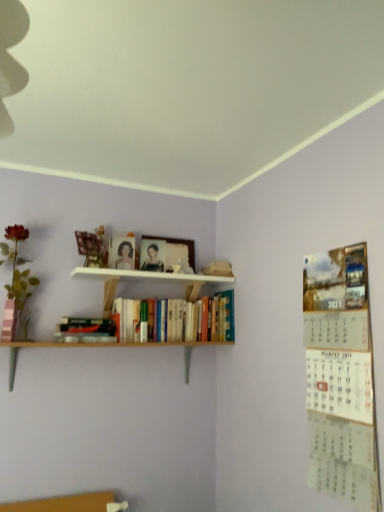
Question: Does wooden picture frame at upper center come behind matte plastic rose at left?

Choices:
 (A) yes
 (B) no

Answer: (A)

Question: Is wooden picture frame at upper center smaller than matte plastic rose at left?

Choices:
 (A) yes
 (B) no

Answer: (A)

Question: From the image's perspective, is wooden picture frame at upper center under matte plastic rose at left?

Choices:
 (A) yes
 (B) no

Answer: (B)

Question: Does wooden picture frame at upper center have a lesser height compared to matte plastic rose at left?

Choices:
 (A) no
 (B) yes

Answer: (B)

Question: From the image's perspective, is wooden picture frame at upper center located above matte plastic rose at left?

Choices:
 (A) yes
 (B) no

Answer: (A)

Question: From a real-world perspective, is wooden picture frame at upper center over matte plastic rose at left?

Choices:
 (A) no
 (B) yes

Answer: (B)

Question: Considering the relative sizes of hardcover book at lower left, the first book in the left-to-right sequence, and wooden picture frame at upper center in the image provided, is hardcover book at lower left, the first book in the left-to-right sequence, wider than wooden picture frame at upper center?

Choices:
 (A) no
 (B) yes

Answer: (B)

Question: Is hardcover book at lower left, the second book viewed from the right, behind wooden picture frame at upper center?

Choices:
 (A) yes
 (B) no

Answer: (B)

Question: Considering the relative sizes of hardcover book at lower left, the first book in the left-to-right sequence, and wooden picture frame at upper center in the image provided, is hardcover book at lower left, the first book in the left-to-right sequence, taller than wooden picture frame at upper center?

Choices:
 (A) no
 (B) yes

Answer: (A)

Question: Are hardcover book at lower left, the first book in the left-to-right sequence, and wooden picture frame at upper center far apart?

Choices:
 (A) no
 (B) yes

Answer: (A)

Question: Does hardcover book at lower left, the first book in the left-to-right sequence, have a lesser width compared to wooden picture frame at upper center?

Choices:
 (A) no
 (B) yes

Answer: (A)

Question: Could wooden picture frame at upper center be considered to be inside hardcover book at lower left, the second book viewed from the right?

Choices:
 (A) yes
 (B) no

Answer: (B)

Question: From the image's perspective, is wooden picture frame at upper center on top of matte black portrait at center?

Choices:
 (A) no
 (B) yes

Answer: (A)